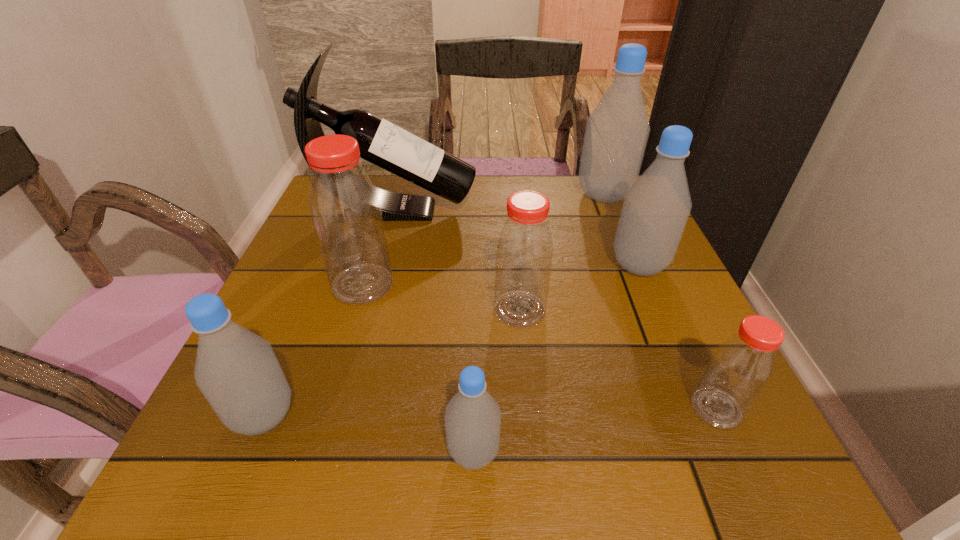
Locate an element on the screen. The height and width of the screenshot is (540, 960). vacant area between the nearest red bottle and the third gray bottle from right to left is located at coordinates (595, 430).

Where is `vacant space that's between the smallest gray bottle and the biggest gray bottle`? This screenshot has width=960, height=540. vacant space that's between the smallest gray bottle and the biggest gray bottle is located at coordinates (539, 323).

What are the coordinates of `unoccupied position between the second red bottle from left to right and the smallest gray bottle` in the screenshot? It's located at (496, 381).

Where is `vacant area that lies between the second red bottle from left to right and the black wine bottle`? Image resolution: width=960 pixels, height=540 pixels. vacant area that lies between the second red bottle from left to right and the black wine bottle is located at coordinates (457, 260).

You are a GUI agent. You are given a task and a screenshot of the screen. Output one action in this format:
    pyautogui.click(x=<x>, y=<y>)
    Task: Click on the vacant area that lies between the nearest red bottle and the black wine bottle
    The width and height of the screenshot is (960, 540).
    Given the screenshot: What is the action you would take?
    tap(556, 309)

The width and height of the screenshot is (960, 540). Find the location of `free space between the rightmost red bottle and the second red bottle from left to right`. free space between the rightmost red bottle and the second red bottle from left to right is located at coordinates (618, 359).

At what (x,y) coordinates should I click in order to perform the action: click on vacant area that lies between the wine bottle and the farthest gray bottle. Please return your answer as a coordinate pair (x, y). The width and height of the screenshot is (960, 540). Looking at the image, I should click on (499, 202).

This screenshot has width=960, height=540. In order to click on object that can be found as the seventh closest to the black wine bottle in this screenshot , I will do `click(741, 367)`.

Find the location of a particular element. The height and width of the screenshot is (540, 960). object that is the fourth closest to the smallest gray bottle is located at coordinates [741, 367].

Identify which bottle is the fifth nearest to the second smallest gray bottle. Please provide its 2D coordinates. Your answer should be formatted as a tuple, i.e. [(x, y)], where the tuple contains the x and y coordinates of a point satisfying the conditions above.

[(656, 208)]